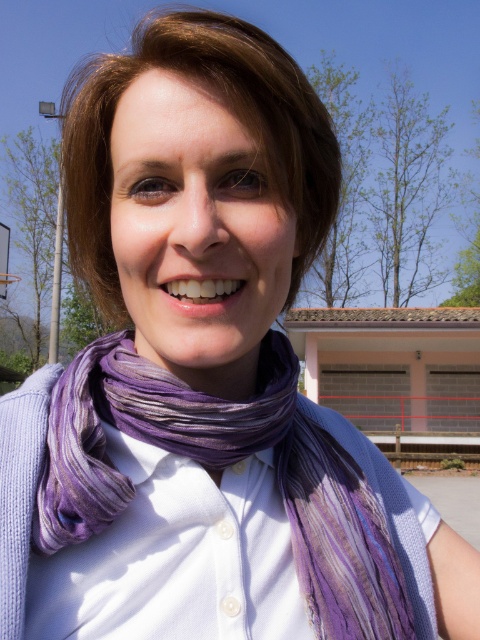
Question: Which point is farther from the camera taking this photo?

Choices:
 (A) (203, 460)
 (B) (211, 326)

Answer: (A)

Question: Does purple silk scarf at center appear on the right side of purple striped scarf at center?

Choices:
 (A) yes
 (B) no

Answer: (A)

Question: Can you confirm if purple silk scarf at center is positioned below purple striped scarf at center?

Choices:
 (A) no
 (B) yes

Answer: (B)

Question: Does purple silk scarf at center have a greater width compared to purple striped scarf at center?

Choices:
 (A) yes
 (B) no

Answer: (A)

Question: Among these points, which one is farthest from the camera?

Choices:
 (A) (120, 376)
 (B) (175, 339)

Answer: (A)